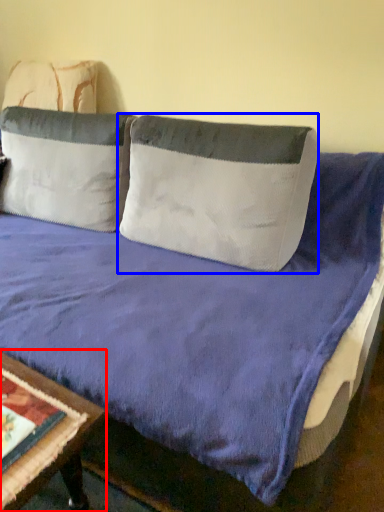
Question: Which point is further to the camera, table (highlighted by a red box) or pillow (highlighted by a blue box)?

Choices:
 (A) table
 (B) pillow

Answer: (B)